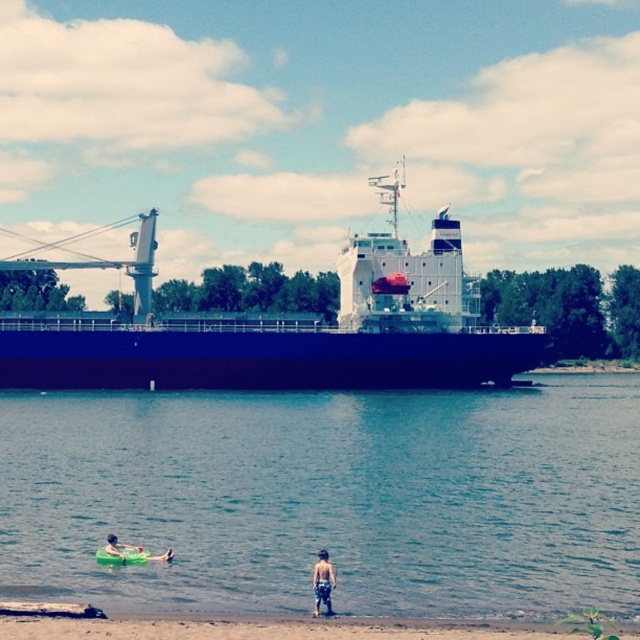
Question: Which object appears closest to the camera in this image?

Choices:
 (A) blue matte ship at center
 (B) tan skin human at lower center
 (C) brown sandy beach at lower center

Answer: (C)

Question: Is clear blue water at lower center below brown sandy beach at lower center?

Choices:
 (A) yes
 (B) no

Answer: (B)

Question: From the image, what is the correct spatial relationship of tan skin human at lower center in relation to green rubber ring at lower left?

Choices:
 (A) right
 (B) left

Answer: (A)

Question: Does clear blue water at lower center appear on the left side of green rubber ring at lower left?

Choices:
 (A) no
 (B) yes

Answer: (A)

Question: Which object is the farthest from the brown sandy beach at lower center?

Choices:
 (A) tan skin human at lower center
 (B) blue matte ship at center
 (C) green rubber ring at lower left

Answer: (B)

Question: Which point is farther to the camera?

Choices:
 (A) tan skin human at lower center
 (B) blue matte ship at center
 (C) green rubber ring at lower left

Answer: (B)